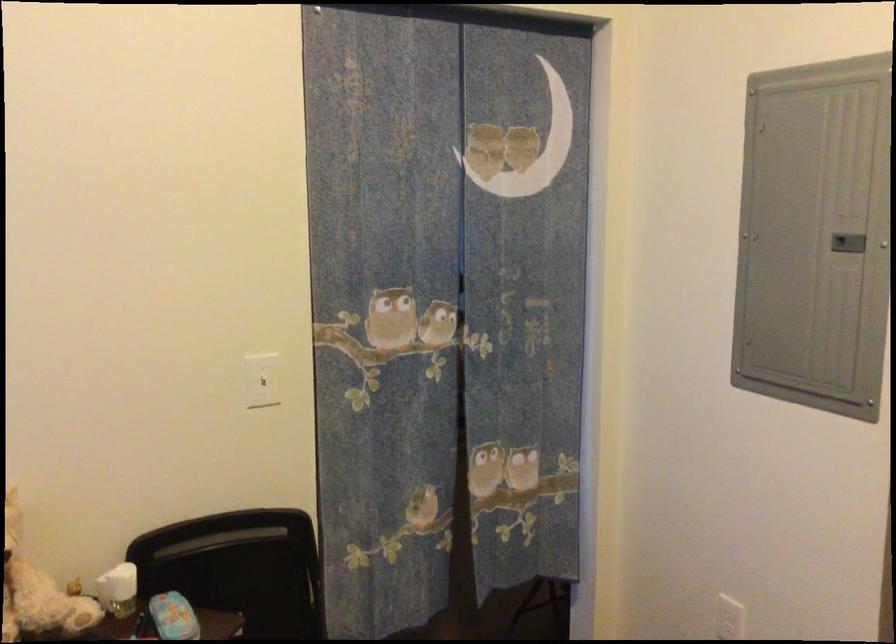
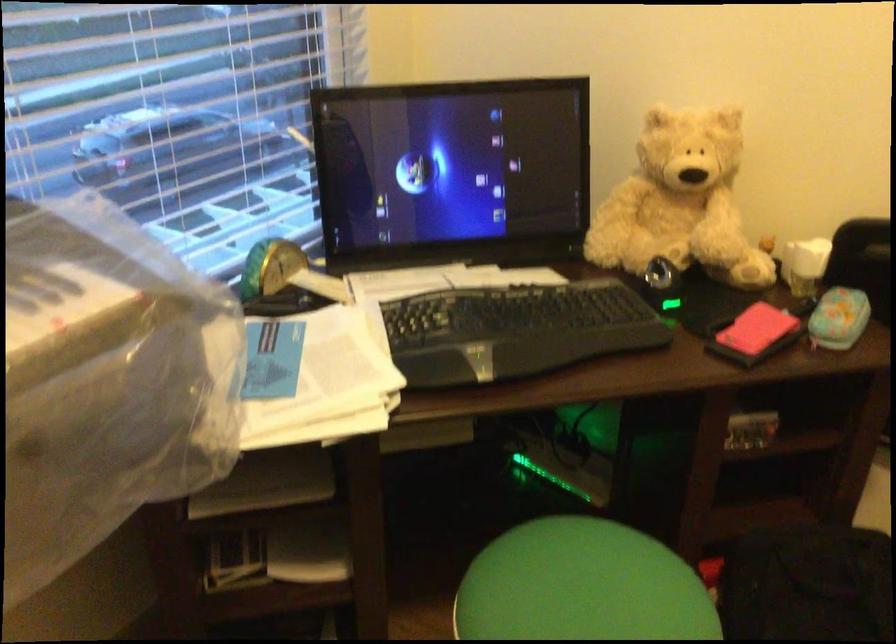
How did the camera likely rotate?

The camera's rotation is toward left-down.